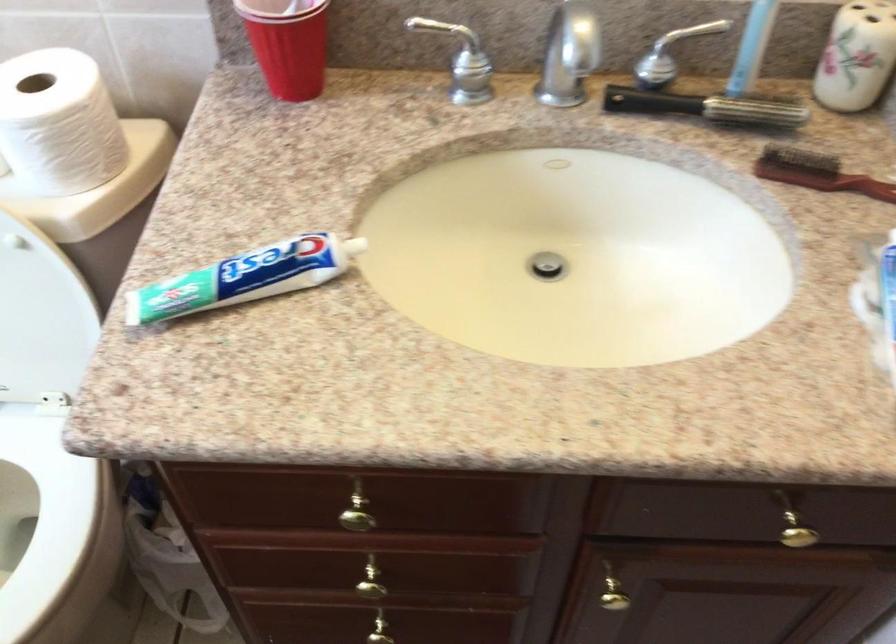
Find where to lift the toothbrush holder. Please return your answer as a coordinate pair (x, y).

(288, 44)